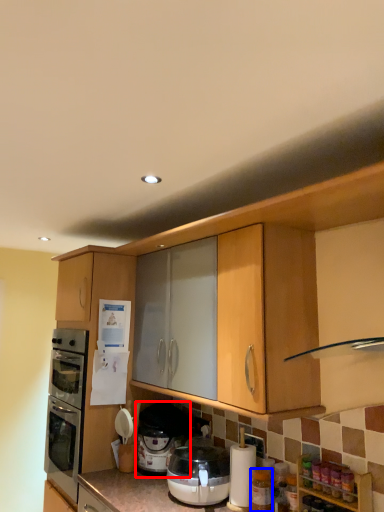
Question: Which of the following is the farthest to the observer, pressure cooker (highlighted by a red box) or bottle (highlighted by a blue box)?

Choices:
 (A) pressure cooker
 (B) bottle

Answer: (A)